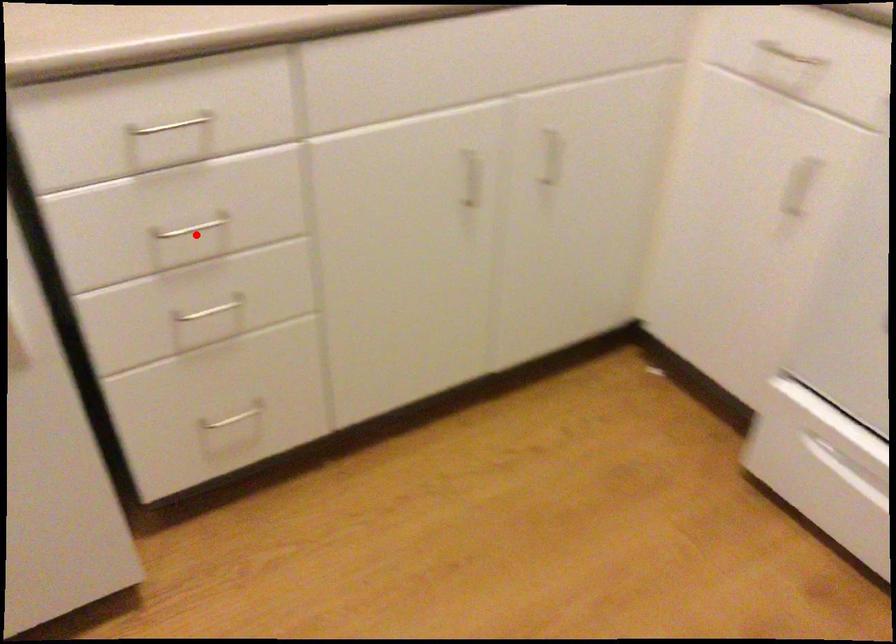
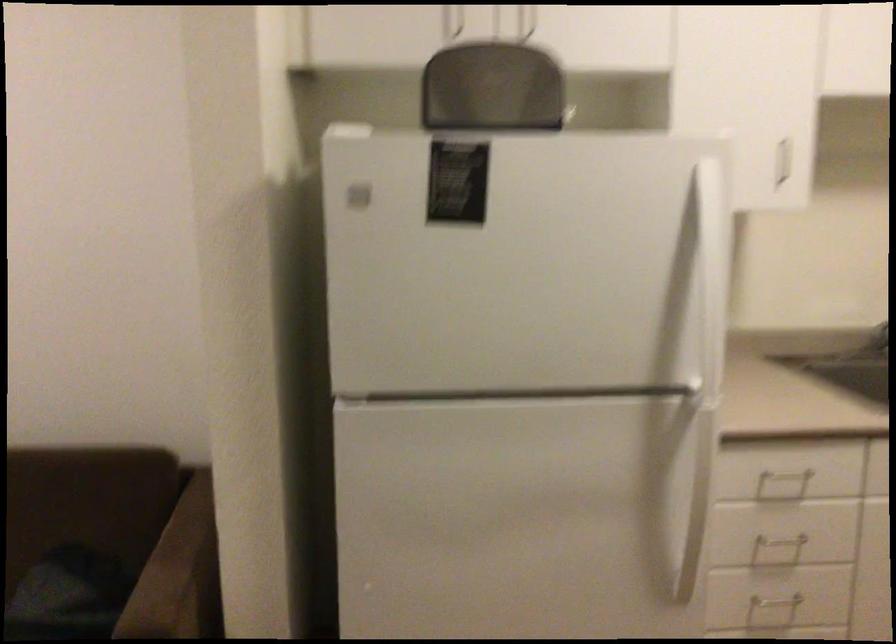
Locate, in the second image, the point that corresponds to the highlighted location in the first image.

(778, 547)